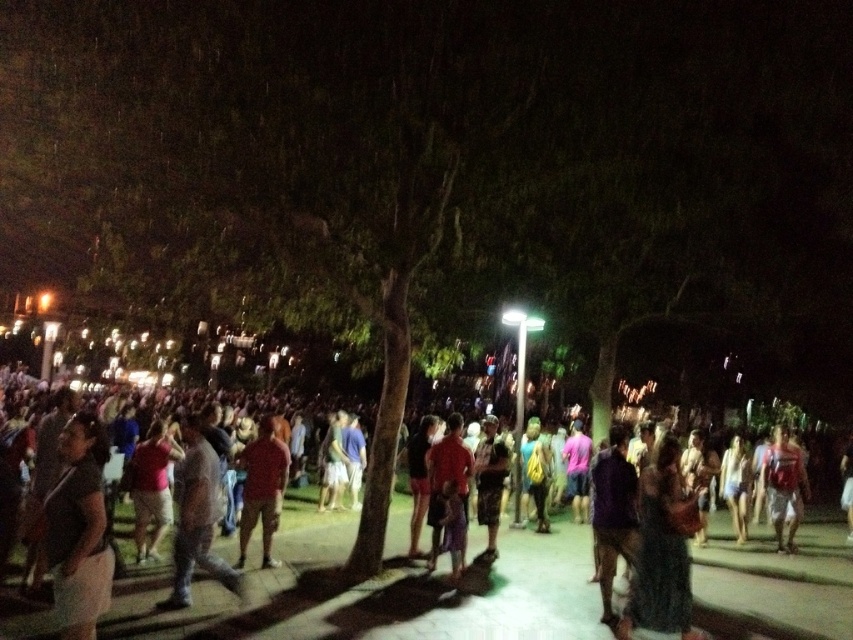
Question: Considering the real-world distances, which object is closest to the dark gray fabric shirt at lower left?

Choices:
 (A) red fabric shirt at right
 (B) dark gray casual pants at center
 (C) dark gray shirt at center

Answer: (B)

Question: Is dark gray shirt at center to the right of dark gray casual pants at center from the viewer's perspective?

Choices:
 (A) yes
 (B) no

Answer: (A)

Question: Which of the following is the closest to the observer?

Choices:
 (A) (782, 445)
 (B) (96, 538)
 (C) (248, 531)

Answer: (B)

Question: Which point appears closest to the camera in this image?

Choices:
 (A) (200, 520)
 (B) (799, 467)

Answer: (A)

Question: Does dark gray casual pants at center appear under matte red shirt at center?

Choices:
 (A) yes
 (B) no

Answer: (B)

Question: Is dark gray fabric shirt at lower left positioned before dark gray casual pants at center?

Choices:
 (A) no
 (B) yes

Answer: (B)